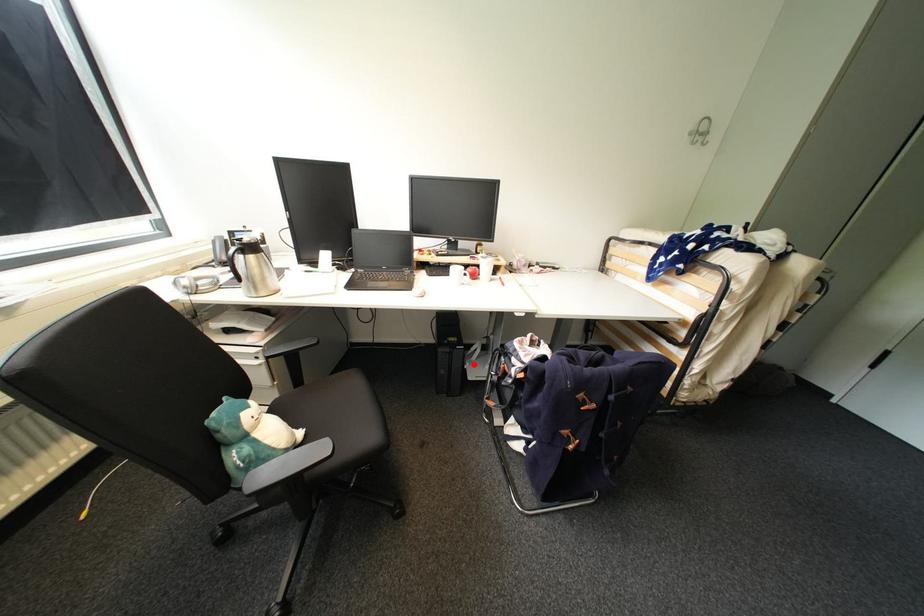
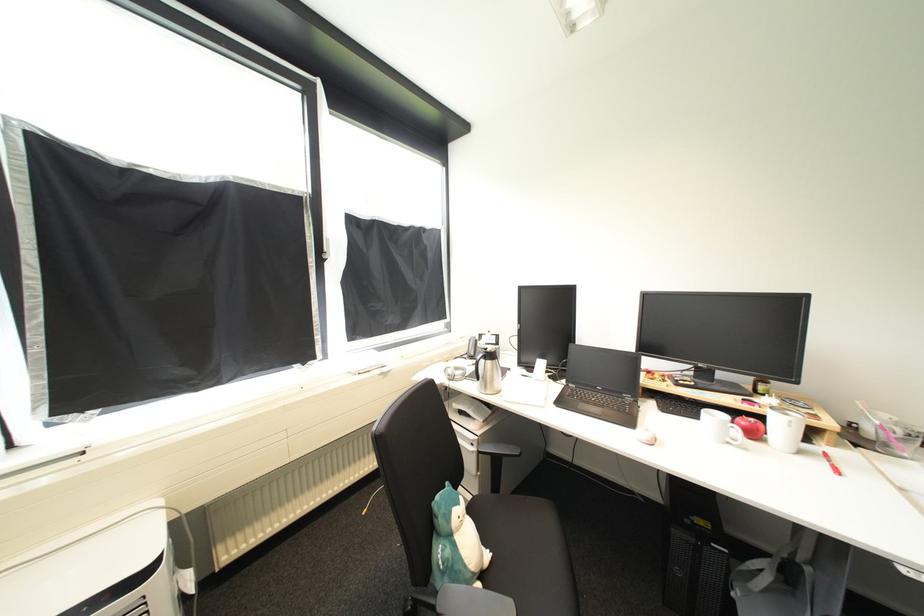
Question: I am providing you with two images of the same scene from different viewpoints. Image1 has a red point marked. In image2, the corresponding 3D location appears at what relative position? Reply with the corresponding letter.

Choices:
 (A) Closer
 (B) Farther

Answer: (B)